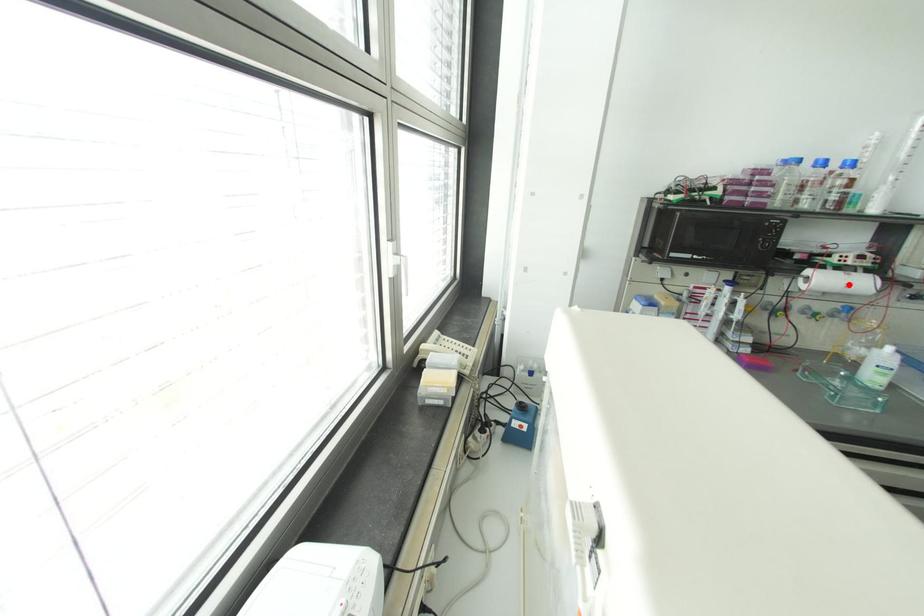
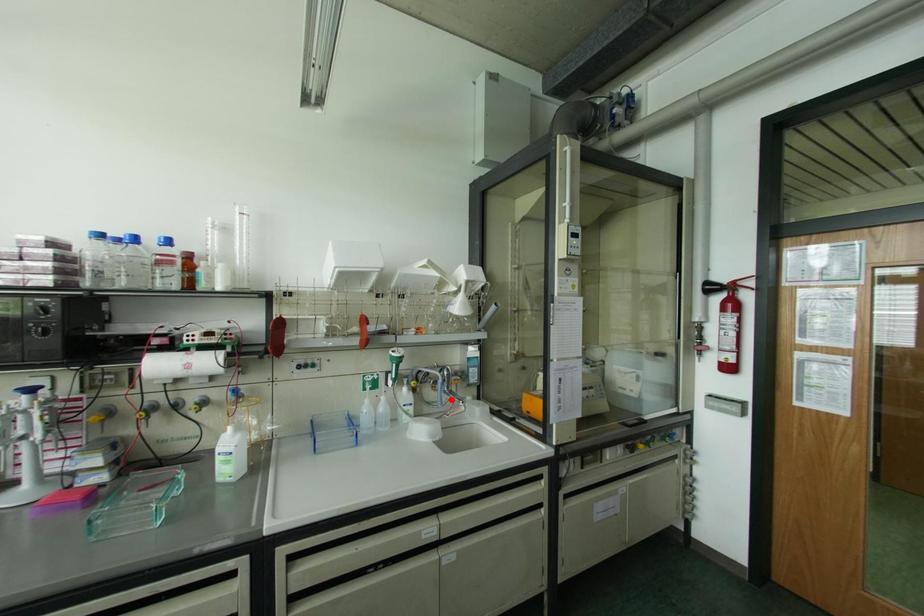
I am providing you with two images of the same scene from different viewpoints. A red point is marked on the first image and another point is marked on the second image. Does the point marked in image1 correspond to the same location as the one in image2?

No